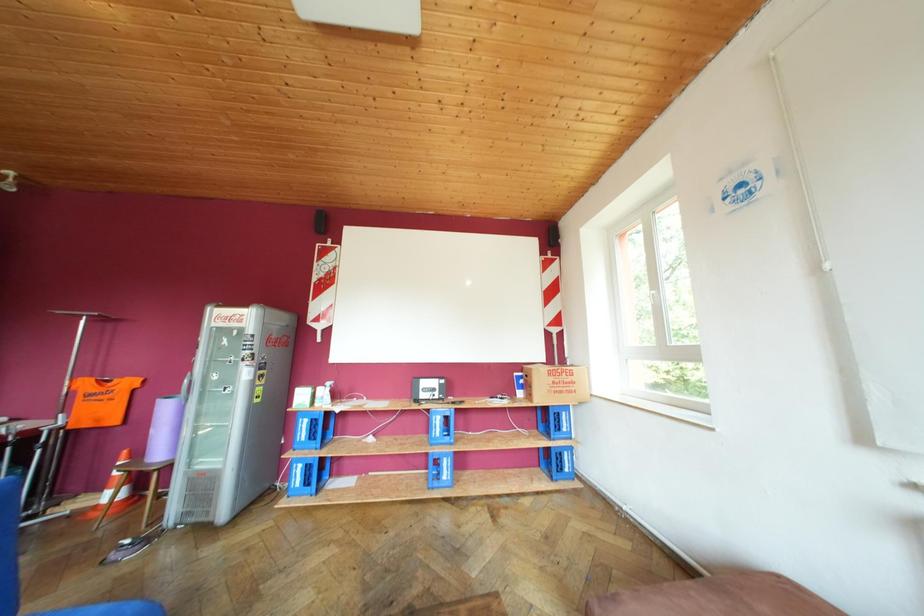
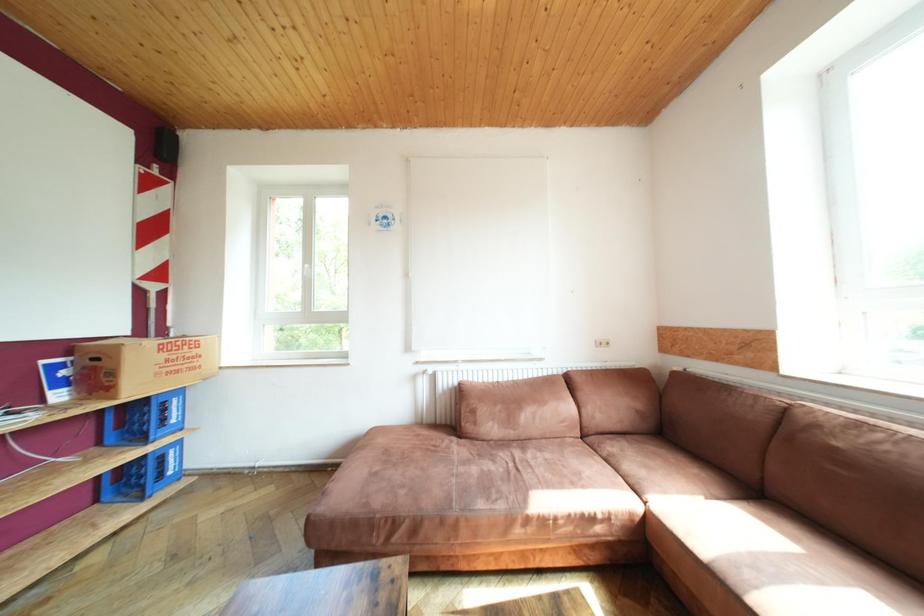
Question: The camera is either moving clockwise (left) or counter-clockwise (right) around the object. The first image is from the beginning of the video and the second image is from the end. Is the camera moving left or right when shooting the video?

Choices:
 (A) Left
 (B) Right

Answer: (A)